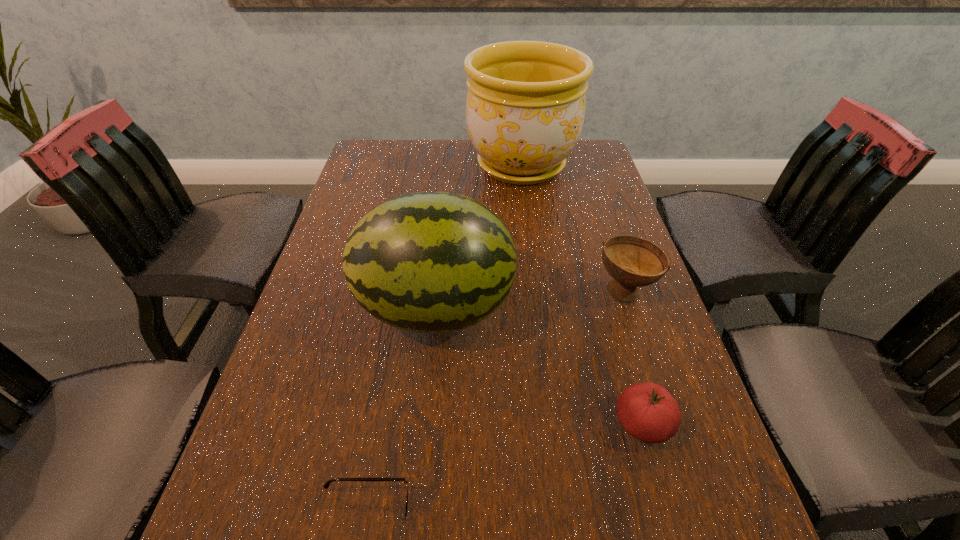
You are a GUI agent. You are given a task and a screenshot of the screen. Output one action in this format:
    pyautogui.click(x=<x>, y=<y>)
    Task: Click on the free spot between the fourth farthest object and the farthest object
    The width and height of the screenshot is (960, 540).
    Given the screenshot: What is the action you would take?
    pyautogui.click(x=582, y=294)

The image size is (960, 540). I want to click on free area in between the tomato and the third tallest object, so click(x=634, y=357).

What are the coordinates of `free space between the second tallest object and the third tallest object` in the screenshot? It's located at (530, 300).

You are a GUI agent. You are given a task and a screenshot of the screen. Output one action in this format:
    pyautogui.click(x=<x>, y=<y>)
    Task: Click on the unoccupied area between the tomato and the soup bowl
    
    Given the screenshot: What is the action you would take?
    pyautogui.click(x=634, y=357)

This screenshot has width=960, height=540. I want to click on free spot between the second nearest object and the third tallest object, so click(634, 357).

At what (x,y) coordinates should I click in order to perform the action: click on object that stands as the closest to the third shortest object. Please return your answer as a coordinate pair (x, y). This screenshot has width=960, height=540. Looking at the image, I should click on (427, 262).

You are a GUI agent. You are given a task and a screenshot of the screen. Output one action in this format:
    pyautogui.click(x=<x>, y=<y>)
    Task: Click on the object that is the third closest to the farthest object
    This screenshot has width=960, height=540.
    Given the screenshot: What is the action you would take?
    pyautogui.click(x=647, y=411)

At what (x,y) coordinates should I click in order to perform the action: click on free space that satisfies the following two spatial constraints: 1. on the back side of the third tallest object; 2. on the right side of the tomato. Please return your answer as a coordinate pair (x, y). Looking at the image, I should click on pos(605,291).

At what (x,y) coordinates should I click in order to perform the action: click on vacant space that satisfies the following two spatial constraints: 1. at the stem end of the fourth farthest object; 2. on the right side of the watermelon. Please return your answer as a coordinate pair (x, y). Looking at the image, I should click on (424, 424).

Find the location of `vacant point that satisfies the following two spatial constraints: 1. on the front side of the third tallest object; 2. at the stem end of the fourth shortest object`. vacant point that satisfies the following two spatial constraints: 1. on the front side of the third tallest object; 2. at the stem end of the fourth shortest object is located at coordinates (631, 309).